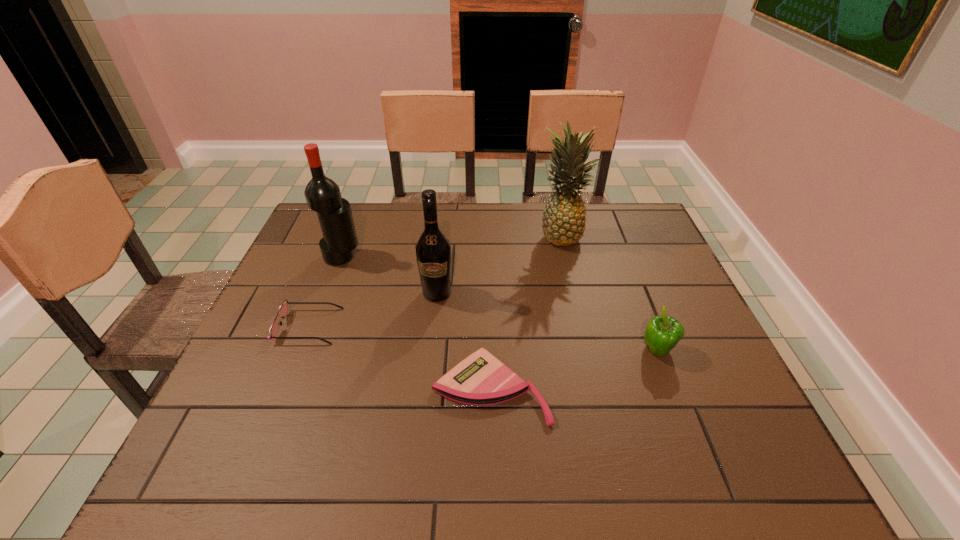
The height and width of the screenshot is (540, 960). I want to click on blank space at the left edge of the desktop, so click(x=308, y=286).

Find the location of a particular element. Image resolution: width=960 pixels, height=540 pixels. vacant region at the right edge of the desktop is located at coordinates (650, 308).

In the image, there is a desktop. Where is `vacant space at the far right corner`? vacant space at the far right corner is located at coordinates (617, 241).

Locate an element on the screen. The image size is (960, 540). free point between the wristlet and the left wine bottle is located at coordinates [x=417, y=322].

The height and width of the screenshot is (540, 960). Find the location of `empty space that is in between the wristlet and the third farthest object`. empty space that is in between the wristlet and the third farthest object is located at coordinates (464, 341).

Image resolution: width=960 pixels, height=540 pixels. In order to click on blank region between the wristlet and the third farthest object in this screenshot , I will do `click(464, 341)`.

I want to click on vacant area that lies between the sunglasses and the shortest object, so click(399, 357).

Locate an element on the screen. The image size is (960, 540). empty space that is in between the sunglasses and the wristlet is located at coordinates (399, 357).

Identify the location of free point between the rightmost object and the wristlet. This screenshot has width=960, height=540. (574, 370).

Where is `empty space that is in between the fourth nearest object and the wristlet`? This screenshot has height=540, width=960. empty space that is in between the fourth nearest object and the wristlet is located at coordinates (464, 341).